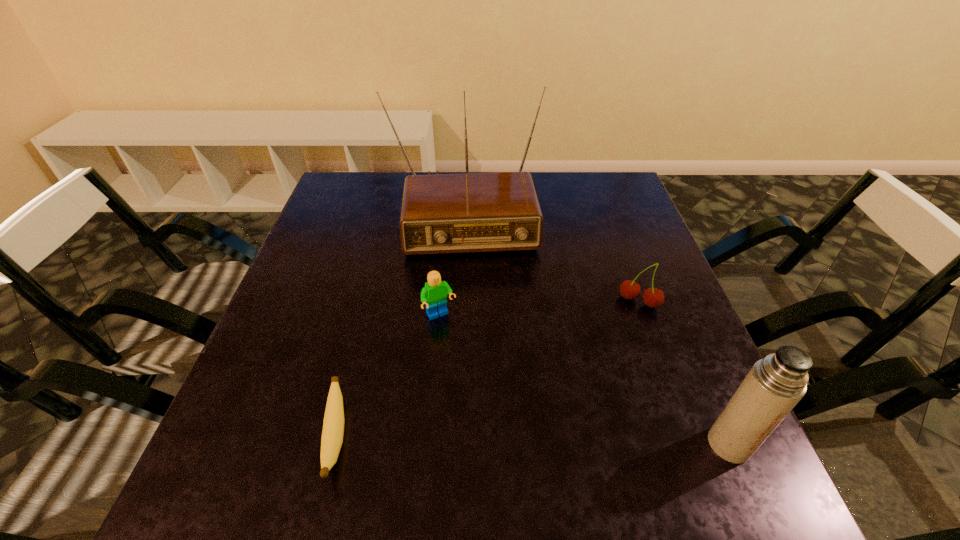
Find the location of a particular element. vacant space on the desktop that is between the shortest object and the second tallest object and is positioned on the face of the Lego is located at coordinates (511, 439).

The image size is (960, 540). I want to click on vacant space on the desktop that is between the shortest object and the fourth shortest object and is positioned on the surface of the cherry, so click(x=568, y=441).

Identify the location of vacant space on the desktop that is between the shortest object and the thermos bottle and is positioned on the front panel of the farthest object. (480, 438).